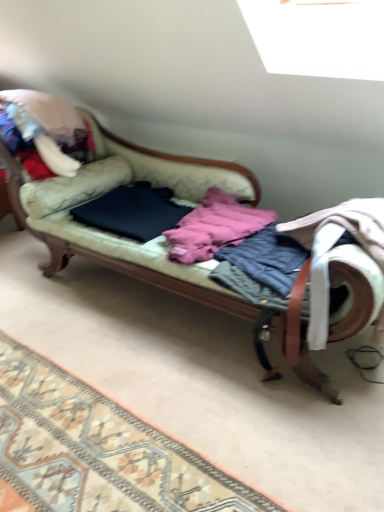
Question: Is patterned carpet at lower left taller than pink fleece jacket at center, the 2th clothing positioned from the left?

Choices:
 (A) no
 (B) yes

Answer: (A)

Question: From a real-world perspective, is patterned carpet at lower left beneath pink fleece jacket at center, marked as the second clothing in a right-to-left arrangement?

Choices:
 (A) yes
 (B) no

Answer: (A)

Question: Can you confirm if patterned carpet at lower left is thinner than pink fleece jacket at center, marked as the second clothing in a right-to-left arrangement?

Choices:
 (A) yes
 (B) no

Answer: (B)

Question: Is patterned carpet at lower left not within pink fleece jacket at center, marked as the second clothing in a right-to-left arrangement?

Choices:
 (A) no
 (B) yes

Answer: (B)

Question: Could you tell me if patterned carpet at lower left is facing pink fleece jacket at center, the 2th clothing positioned from the left?

Choices:
 (A) yes
 (B) no

Answer: (B)

Question: Is patterned carpet at lower left bigger than pink fleece jacket at center, the 2th clothing positioned from the left?

Choices:
 (A) yes
 (B) no

Answer: (B)

Question: Is dark blue fabric at center, positioned as the first clothing in left-to-right order, next to velvet green couch at center and touching it?

Choices:
 (A) no
 (B) yes

Answer: (A)

Question: Is dark blue fabric at center, positioned as the first clothing in left-to-right order, thinner than velvet green couch at center?

Choices:
 (A) no
 (B) yes

Answer: (B)

Question: From the image's perspective, does dark blue fabric at center, positioned as the first clothing in left-to-right order, appear lower than velvet green couch at center?

Choices:
 (A) yes
 (B) no

Answer: (B)

Question: Is dark blue fabric at center, the third clothing when ordered from right to left, bigger than velvet green couch at center?

Choices:
 (A) yes
 (B) no

Answer: (B)

Question: Are dark blue fabric at center, positioned as the first clothing in left-to-right order, and velvet green couch at center located far from each other?

Choices:
 (A) no
 (B) yes

Answer: (A)

Question: Can you confirm if dark blue fabric at center, the third clothing when ordered from right to left, is positioned to the right of velvet green couch at center?

Choices:
 (A) yes
 (B) no

Answer: (B)

Question: Is patterned carpet at lower left behind dark blue fabric at center, positioned as the first clothing in left-to-right order?

Choices:
 (A) no
 (B) yes

Answer: (A)